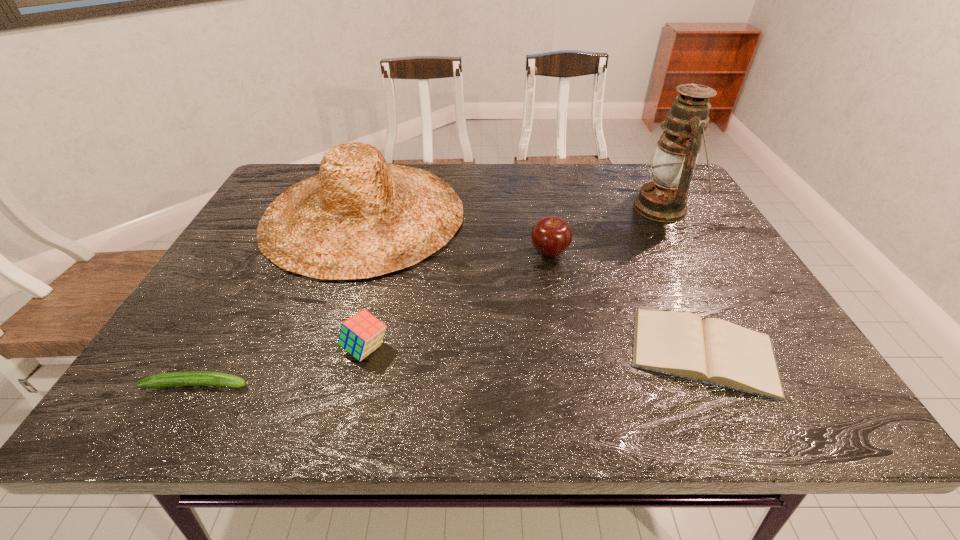
Locate an element on the screen. The height and width of the screenshot is (540, 960). Bible located in the right edge section of the desktop is located at coordinates (713, 351).

This screenshot has height=540, width=960. I want to click on object present at the far left corner, so click(360, 217).

You are a GUI agent. You are given a task and a screenshot of the screen. Output one action in this format:
    pyautogui.click(x=<x>, y=<y>)
    Task: Click on the object situated at the near left corner
    
    Given the screenshot: What is the action you would take?
    pyautogui.click(x=188, y=378)

I want to click on object positioned at the far right corner, so click(x=664, y=199).

The width and height of the screenshot is (960, 540). I want to click on object that is positioned at the near right corner, so click(x=713, y=351).

Where is `free space at the near edge`? free space at the near edge is located at coordinates (568, 388).

The image size is (960, 540). I want to click on free spot at the left edge of the desktop, so click(x=202, y=292).

I want to click on free location at the right edge, so click(697, 274).

You are a GUI agent. You are given a task and a screenshot of the screen. Output one action in this format:
    pyautogui.click(x=<x>, y=<y>)
    Task: Click on the vacant space at the far left corner of the desktop
    This screenshot has width=960, height=540.
    Given the screenshot: What is the action you would take?
    pyautogui.click(x=266, y=202)

Locate an element on the screen. blank space at the near left corner of the desktop is located at coordinates (150, 407).